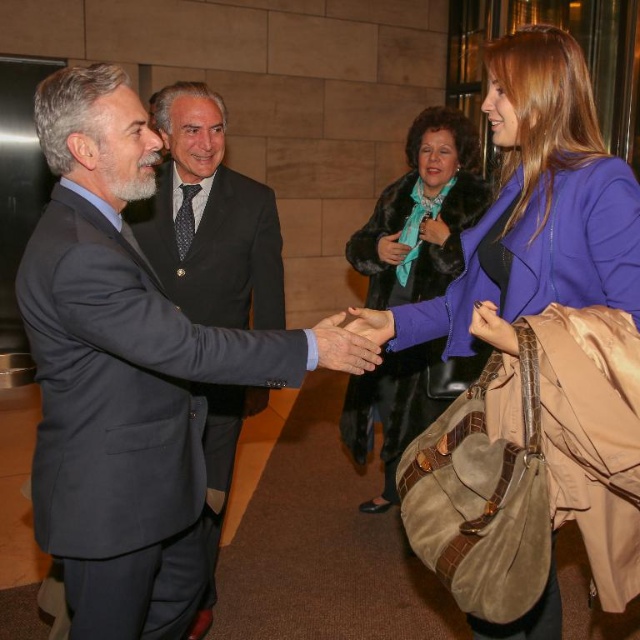
You are an event planner organizing a photoshoot in this setting. You need to position a 1.5 meter tall backdrop behind the two central figures. Considering the height of the purple suede coat at center and the dark blue suit at center, will the backdrop be tall enough to avoid covering their heads?

The purple suede coat at center is shorter than the dark blue suit at center. Since the backdrop is 1.5 meters tall, it should be sufficient to cover both as the tallest clothing item is the dark blue suit at center. However, if the individuals are standing upright, the backdrop might still need to be adjusted to ensure it doesn

You are a photographer setting up for a group photo at the event. You need to position the dark gray wool suit at center and the purple suede coat at center so that both fit within a 2.5 meter wide frame. Based on their widths, can they stand side by side without overlapping?

The dark gray wool suit at center might be wider than purple suede coat at center, so their combined widths may exceed 2.5 meters. It is uncertain if they can fit side by side without overlapping without knowing the exact widths.

You are attending a professional event and need to approach the dark blue suit at center and the velvet teal scarf at center. Which one should you target first to ensure you are approaching the closer object?

The dark blue suit at center is closer to the viewer than the velvet teal scarf at center, so you should target the dark blue suit at center first.